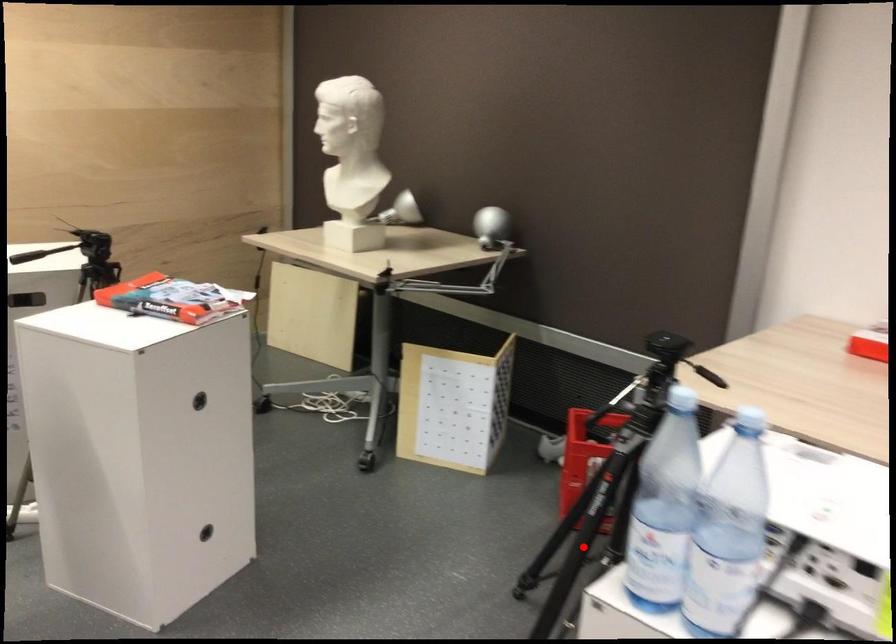
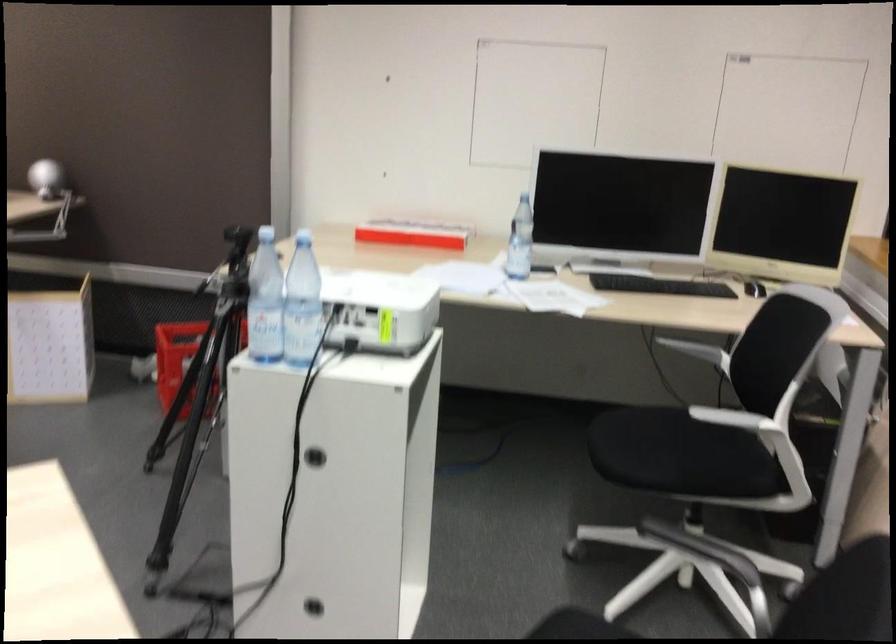
Where in the second image is the point corresponding to the highlighted location from the first image?

(200, 393)